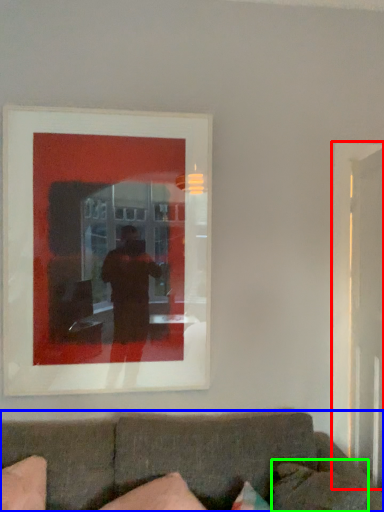
Question: Which object is positioned farthest from glass door (highlighted by a red box)? Select from studio couch (highlighted by a blue box) and pillow (highlighted by a green box).

Choices:
 (A) studio couch
 (B) pillow

Answer: (A)